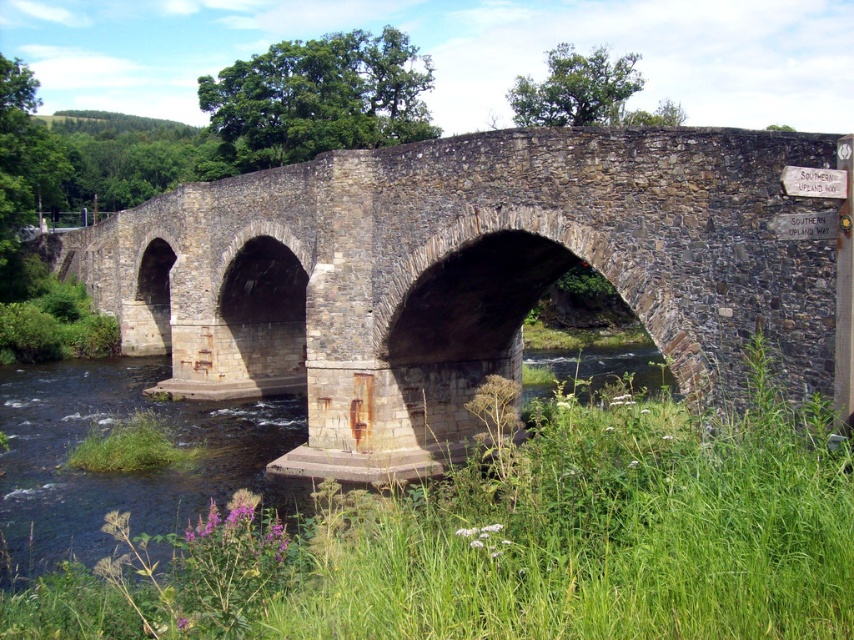
Can you confirm if rusty stone bridge at center is bigger than clear water at bridge lower?

Yes.

Does rusty stone bridge at center have a smaller size compared to clear water at bridge lower?

Incorrect, rusty stone bridge at center is not smaller in size than clear water at bridge lower.

Is point (423, 392) farther from viewer compared to point (569, 362)?

No, (423, 392) is closer to viewer.

This screenshot has height=640, width=854. Identify the location of rusty stone bridge at center. (472, 275).